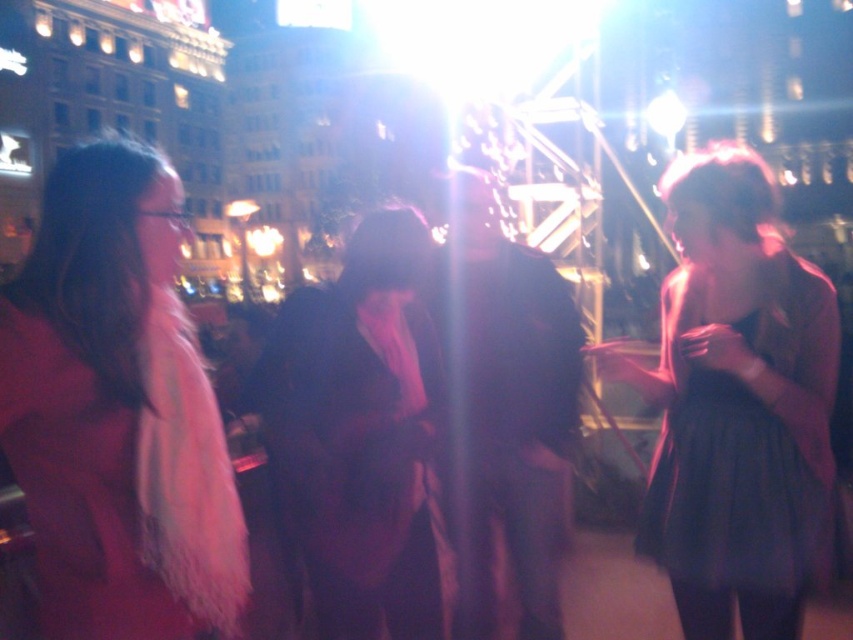
Which is more to the left, matte black dress at right or velvet black coat at center?

From the viewer's perspective, velvet black coat at center appears more on the left side.

Is matte black dress at right taller than velvet black coat at center?

Correct, matte black dress at right is much taller as velvet black coat at center.

What do you see at coordinates (738, 404) in the screenshot? I see `matte black dress at right` at bounding box center [738, 404].

At what (x,y) coordinates should I click in order to perform the action: click on matte black dress at right. Please return your answer as a coordinate pair (x, y). Looking at the image, I should click on (738, 404).

Looking at this image, which of these two, matte pink coat at left or dark brown leather jacket at center, stands taller?

With more height is dark brown leather jacket at center.

Is point (68, 212) closer to viewer compared to point (567, 480)?

Yes, point (68, 212) is in front of point (567, 480).

Which is behind, point (164, 209) or point (555, 344)?

The point (555, 344) is more distant.

In order to click on matte pink coat at left in this screenshot , I will do (x=117, y=412).

Is point (724, 612) positioned in front of point (502, 528)?

Yes, point (724, 612) is closer to viewer.

You are a GUI agent. You are given a task and a screenshot of the screen. Output one action in this format:
    pyautogui.click(x=<x>, y=<y>)
    Task: Click on the matte black dress at right
    
    Given the screenshot: What is the action you would take?
    pyautogui.click(x=738, y=404)

What do you see at coordinates (738, 404) in the screenshot? The image size is (853, 640). I see `matte black dress at right` at bounding box center [738, 404].

Where is `matte black dress at right`? The height and width of the screenshot is (640, 853). matte black dress at right is located at coordinates (738, 404).